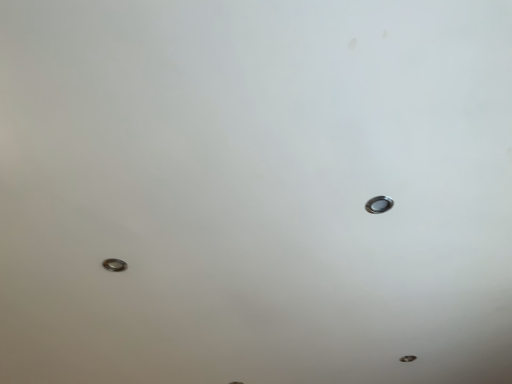
The width and height of the screenshot is (512, 384). What are the coordinates of `silver metallic bolt at lower left` in the screenshot? It's located at (114, 265).

What do you see at coordinates (114, 265) in the screenshot?
I see `silver metallic bolt at lower left` at bounding box center [114, 265].

What do you see at coordinates (379, 204) in the screenshot? I see `silver metallic nail at upper right` at bounding box center [379, 204].

Where is `silver metallic nail at upper right`? silver metallic nail at upper right is located at coordinates (379, 204).

Locate an element on the screen. silver metallic bolt at lower left is located at coordinates (114, 265).

In the scene shown: Which object is positioned more to the left, silver metallic bolt at lower left or silver metallic nail at upper right?

Positioned to the left is silver metallic bolt at lower left.

Looking at this image, is the depth of silver metallic bolt at lower left less than that of silver metallic nail at upper right?

That is False.

Is point (122, 262) farther from camera compared to point (390, 202)?

That is True.

From the image's perspective, which object appears higher, silver metallic bolt at lower left or silver metallic nail at upper right?

From the image's view, silver metallic nail at upper right is above.

Looking at this image, from a real-world perspective, is silver metallic bolt at lower left positioned above or below silver metallic nail at upper right?

silver metallic bolt at lower left is below silver metallic nail at upper right.

Which object is thinner, silver metallic bolt at lower left or silver metallic nail at upper right?

silver metallic nail at upper right.

From their relative heights in the image, would you say silver metallic bolt at lower left is taller or shorter than silver metallic nail at upper right?

silver metallic bolt at lower left is taller than silver metallic nail at upper right.

Can you confirm if silver metallic bolt at lower left is smaller than silver metallic nail at upper right?

Incorrect, silver metallic bolt at lower left is not smaller in size than silver metallic nail at upper right.

Is silver metallic bolt at lower left located outside silver metallic nail at upper right?

Yes, silver metallic bolt at lower left is outside of silver metallic nail at upper right.

Are silver metallic bolt at lower left and silver metallic nail at upper right far apart?

No, silver metallic bolt at lower left is not far from silver metallic nail at upper right.

From the picture: Is silver metallic bolt at lower left aimed at silver metallic nail at upper right?

No.

You are a GUI agent. You are given a task and a screenshot of the screen. Output one action in this format:
    pyautogui.click(x=<x>, y=<y>)
    Task: Click on the nail in front of the silver metallic bolt at lower left
    The height and width of the screenshot is (384, 512).
    Given the screenshot: What is the action you would take?
    pyautogui.click(x=379, y=204)

Between silver metallic nail at upper right and silver metallic bolt at lower left, which one appears on the left side from the viewer's perspective?

silver metallic bolt at lower left.

Who is more distant, silver metallic nail at upper right or silver metallic bolt at lower left?

silver metallic bolt at lower left.

Which is less distant, (372, 198) or (108, 265)?

The point (372, 198) is more forward.

From the image's perspective, between silver metallic nail at upper right and silver metallic bolt at lower left, which one is located above?

From the image's view, silver metallic nail at upper right is above.

Looking at this image, from a real-world perspective, is silver metallic nail at upper right positioned above or below silver metallic bolt at lower left?

In terms of real-world spatial position, silver metallic nail at upper right is above silver metallic bolt at lower left.

Which of these two, silver metallic nail at upper right or silver metallic bolt at lower left, is wider?

silver metallic bolt at lower left is wider.

Is silver metallic nail at upper right taller than silver metallic bolt at lower left?

No, silver metallic nail at upper right is not taller than silver metallic bolt at lower left.

Considering the sizes of objects silver metallic nail at upper right and silver metallic bolt at lower left in the image provided, who is bigger, silver metallic nail at upper right or silver metallic bolt at lower left?

Bigger between the two is silver metallic bolt at lower left.

Is silver metallic bolt at lower left inside silver metallic nail at upper right?

No, silver metallic bolt at lower left is not surrounded by silver metallic nail at upper right.

Is silver metallic nail at upper right positioned far away from silver metallic bolt at lower left?

No, silver metallic nail at upper right is not far away from silver metallic bolt at lower left.

Is silver metallic nail at upper right oriented towards silver metallic bolt at lower left?

Yes, silver metallic nail at upper right is facing silver metallic bolt at lower left.

How much distance is there between silver metallic nail at upper right and silver metallic bolt at lower left?

The distance of silver metallic nail at upper right from silver metallic bolt at lower left is 33.94 inches.

Identify the location of nail lying above the silver metallic bolt at lower left (from the image's perspective). (379, 204).

The height and width of the screenshot is (384, 512). What are the coordinates of `nail above the silver metallic bolt at lower left (from a real-world perspective)` in the screenshot? It's located at (379, 204).

The image size is (512, 384). What are the coordinates of `nail in front of the silver metallic bolt at lower left` in the screenshot? It's located at (379, 204).